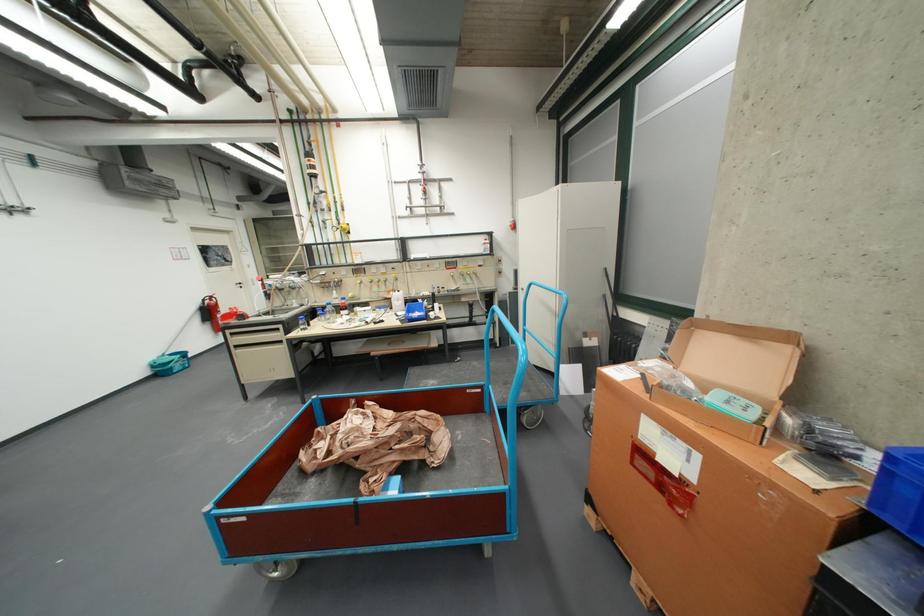
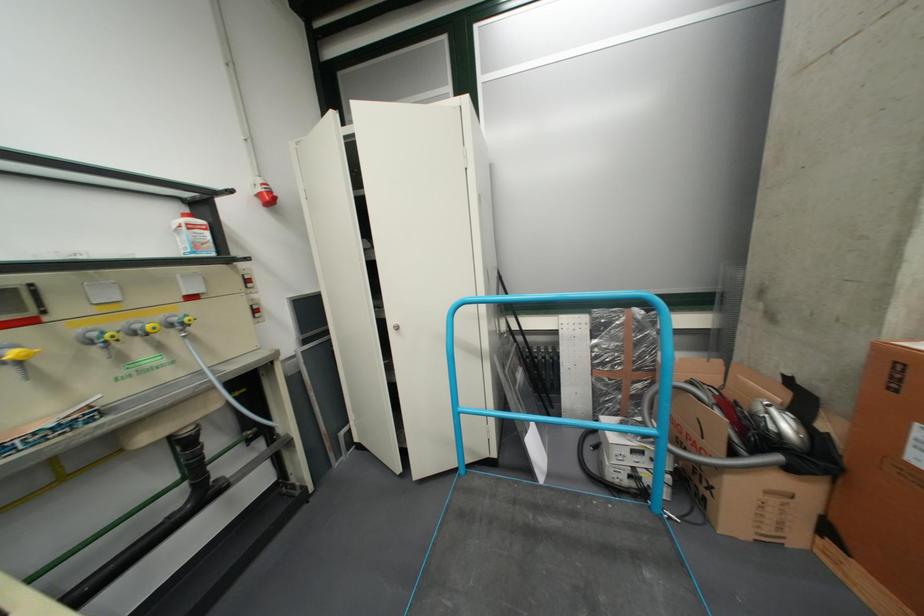
In the second image, find the point that corresponds to the point at 520,223 in the first image.

(260, 185)